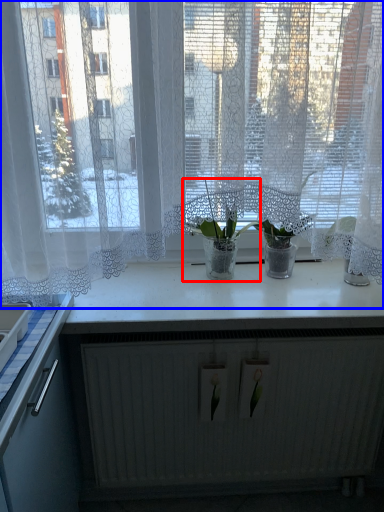
Question: Which object appears closest to the camera in this image, houseplant (highlighted by a red box) or window (highlighted by a blue box)?

Choices:
 (A) houseplant
 (B) window

Answer: (B)